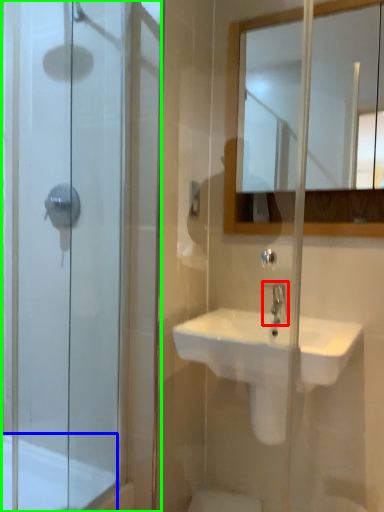
Question: Which is nearer to the tap (highlighted by a red box)? bath (highlighted by a blue box) or screen door (highlighted by a green box).

Choices:
 (A) bath
 (B) screen door

Answer: (B)